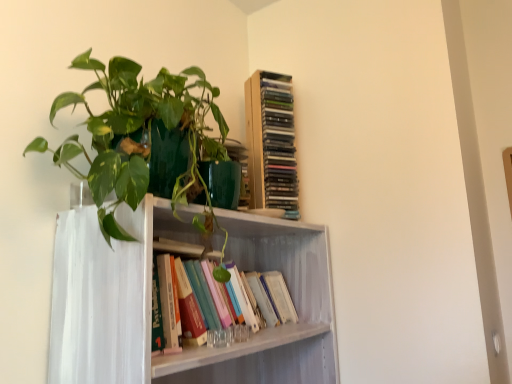
Question: Based on their sizes in the image, would you say wooden cd tower at upper center, the first book in the top-to-bottom sequence, is bigger or smaller than hardcover books at center, the 2th book in the top-to-bottom sequence?

Choices:
 (A) big
 (B) small

Answer: (B)

Question: From a real-world perspective, is wooden cd tower at upper center, the first book in the top-to-bottom sequence, above or below hardcover books at center, the 2th book in the top-to-bottom sequence?

Choices:
 (A) above
 (B) below

Answer: (A)

Question: Based on their relative distances, which object is nearer to the wooden cd tower at upper center, the first book in the top-to-bottom sequence?

Choices:
 (A) white painted wood shelf at center
 (B) hardcover books at center, which is the first book from bottom to top
 (C) green glossy plant at upper left

Answer: (A)

Question: Based on their relative distances, which object is farther from the green glossy plant at upper left?

Choices:
 (A) white painted wood shelf at center
 (B) wooden cd tower at upper center, the first book in the top-to-bottom sequence
 (C) hardcover books at center, which is the first book from bottom to top

Answer: (B)